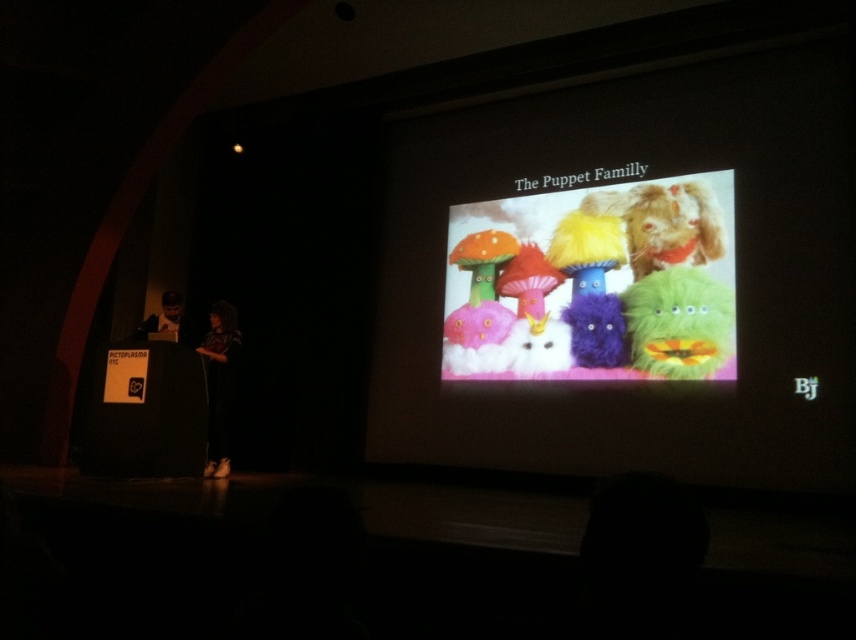
The width and height of the screenshot is (856, 640). I want to click on fluffy brown dog at upper right, so click(x=670, y=227).

Is the position of fluffy brown dog at upper right more distant than that of matte black laptop at left?

That is True.

Who is more forward, [693,250] or [177,292]?

Point [693,250]

Identify the location of fluffy brown dog at upper right. (670, 227).

Does fluffy green toy at center appear over matte black clothing at center?

Yes, fluffy green toy at center is above matte black clothing at center.

What are the coordinates of `fluffy green toy at center` in the screenshot? It's located at (678, 323).

Find the location of a particular element. The width and height of the screenshot is (856, 640). fluffy green toy at center is located at coordinates (678, 323).

Can you confirm if fuzzy plushies at center is positioned above fluffy brown dog at upper right?

Actually, fuzzy plushies at center is below fluffy brown dog at upper right.

Is fuzzy plushies at center wider than fluffy brown dog at upper right?

Correct, the width of fuzzy plushies at center exceeds that of fluffy brown dog at upper right.

Is point (651, 368) in front of point (684, 205)?

Yes, point (651, 368) is closer to viewer.

This screenshot has width=856, height=640. Find the location of `fuzzy plushies at center`. fuzzy plushies at center is located at coordinates (593, 284).